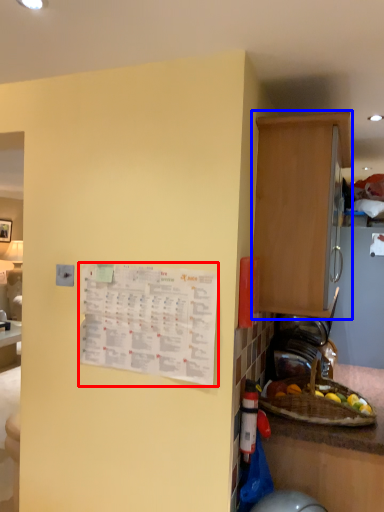
Question: Which object appears closest to the camera in this image, poster (highlighted by a red box) or cabinetry (highlighted by a blue box)?

Choices:
 (A) poster
 (B) cabinetry

Answer: (A)